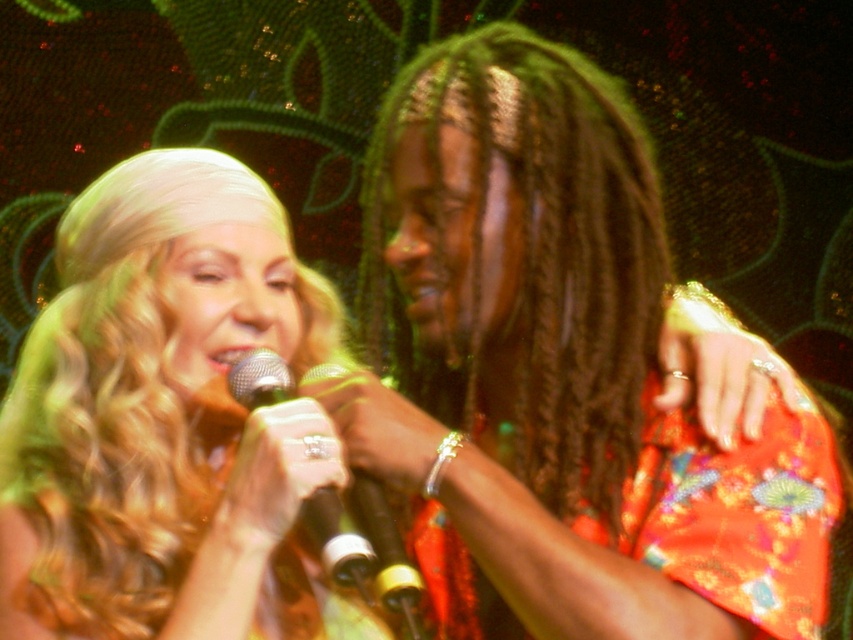
Which is more to the left, metallic silver microphone at center or black metallic microphone at center?

From the viewer's perspective, metallic silver microphone at center appears more on the left side.

Does point (343, 531) lie in front of point (374, 525)?

Yes.

Measure the distance between metallic silver microphone at center and camera.

metallic silver microphone at center is 29.68 inches away from camera.

Where is `metallic silver microphone at center`? This screenshot has height=640, width=853. metallic silver microphone at center is located at coordinates (337, 540).

Between shiny orange dress at center and metallic silver microphone at center, which one is positioned lower?

metallic silver microphone at center is below.

Is shiny orange dress at center further to camera compared to metallic silver microphone at center?

Yes.

Find the location of a particular element. Image resolution: width=853 pixels, height=640 pixels. shiny orange dress at center is located at coordinates (556, 372).

Who is positioned more to the left, shiny orange dress at center or blonde hair at center?

blonde hair at center is more to the left.

This screenshot has width=853, height=640. What do you see at coordinates (556, 372) in the screenshot?
I see `shiny orange dress at center` at bounding box center [556, 372].

At what (x,y) coordinates should I click in order to perform the action: click on shiny orange dress at center. Please return your answer as a coordinate pair (x, y). The height and width of the screenshot is (640, 853). Looking at the image, I should click on click(556, 372).

You are a GUI agent. You are given a task and a screenshot of the screen. Output one action in this format:
    pyautogui.click(x=<x>, y=<y>)
    Task: Click on the shiny orange dress at center
    This screenshot has width=853, height=640.
    Given the screenshot: What is the action you would take?
    pyautogui.click(x=556, y=372)